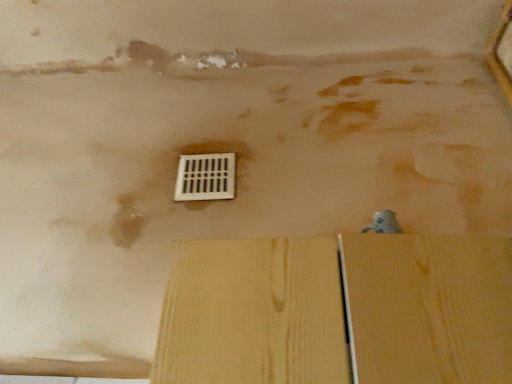
The height and width of the screenshot is (384, 512). I want to click on white plastic vent at center, so click(x=206, y=177).

Image resolution: width=512 pixels, height=384 pixels. What do you see at coordinates (206, 177) in the screenshot? I see `white plastic vent at center` at bounding box center [206, 177].

This screenshot has height=384, width=512. I want to click on white plastic vent at center, so click(x=206, y=177).